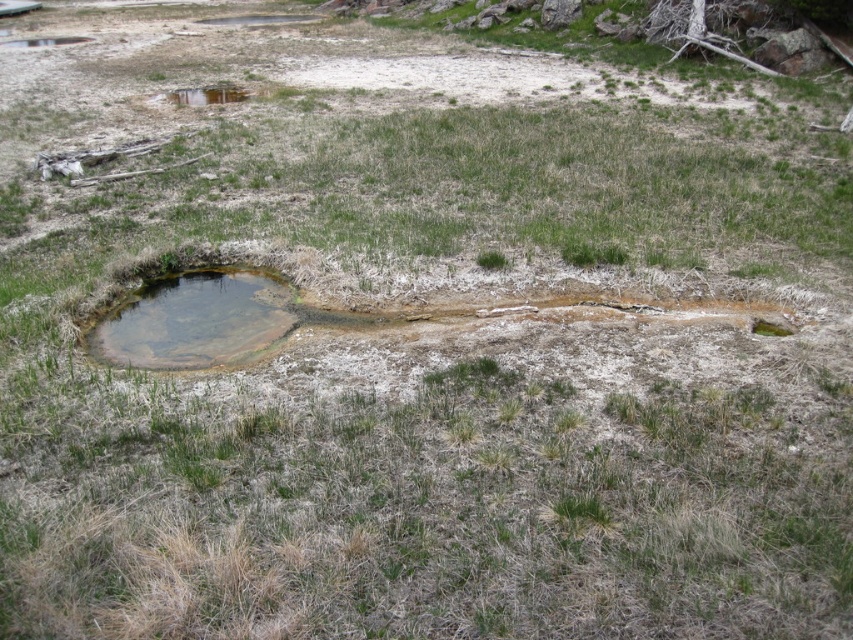
You are a geologist examining the landscape. You need to collect samples from both the brown sedimentary pool at center and the brown sedimentary rock at lower right. Which object should you visit first if you want to start from the leftmost point of the scene?

The brown sedimentary pool at center is to the left of brown sedimentary rock at lower right, so you should start by visiting the brown sedimentary pool at center first since it is positioned further to the left.

You are a geologist examining the landscape. You notice the brown sedimentary pool at center and the brown sedimentary rock at lower right. Which object is closer to you based on their positions in the scene?

The brown sedimentary pool at center is closer to you because it is in front of the brown sedimentary rock at lower right.